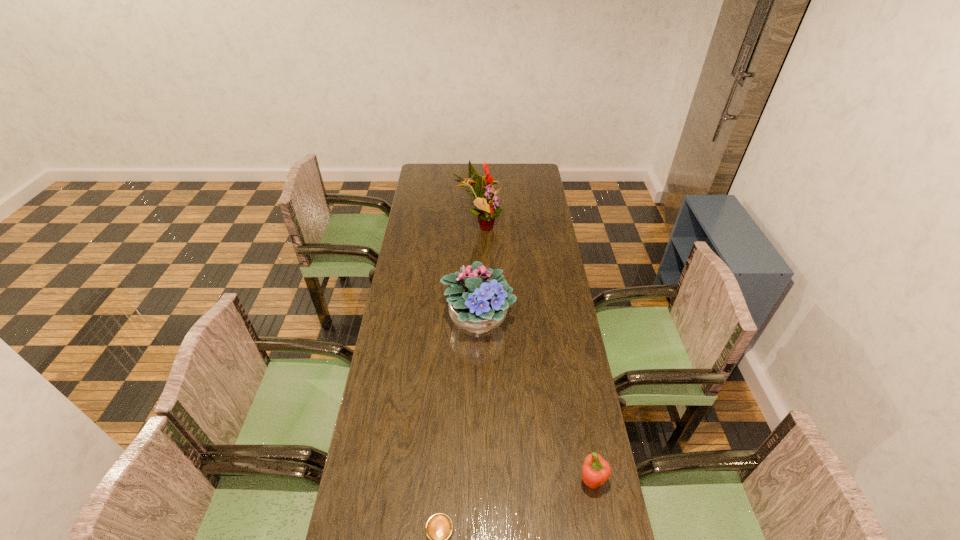
Locate an element on the screen. vacant space at the far edge of the desktop is located at coordinates (482, 168).

In the image, there is a desktop. Find the location of `vacant space at the left edge`. vacant space at the left edge is located at coordinates (388, 382).

Where is `vacant space at the right edge of the desktop`? vacant space at the right edge of the desktop is located at coordinates (590, 520).

Locate an element on the screen. free spot between the shorter bouquet and the pepper is located at coordinates pyautogui.click(x=535, y=400).

You are a GUI agent. You are given a task and a screenshot of the screen. Output one action in this format:
    pyautogui.click(x=<x>, y=<y>)
    Task: Click on the vacant area between the third shortest object and the pepper
    
    Given the screenshot: What is the action you would take?
    pyautogui.click(x=535, y=400)

The width and height of the screenshot is (960, 540). Find the location of `unoccupied position between the farthest object and the second nearest object`. unoccupied position between the farthest object and the second nearest object is located at coordinates (535, 353).

Identify the location of the closest object relative to the shorter bouquet. (485, 196).

Locate an element on the screen. The image size is (960, 540). object that stands as the third closest to the chalice is located at coordinates (485, 196).

This screenshot has width=960, height=540. I want to click on vacant region that satisfies the following two spatial constraints: 1. on the front-facing side of the second nearest object; 2. on the left side of the farther bouquet, so click(x=478, y=481).

At what (x,y) coordinates should I click in order to perform the action: click on free location that satisfies the following two spatial constraints: 1. on the front-facing side of the farthest object; 2. on the front side of the second farthest object. Please return your answer as a coordinate pair (x, y). Image resolution: width=960 pixels, height=540 pixels. Looking at the image, I should click on (479, 320).